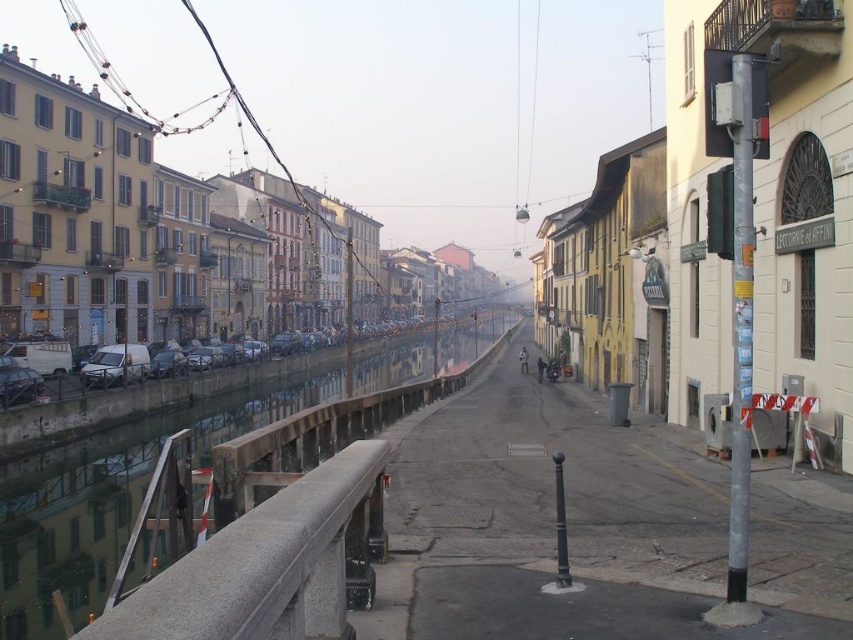
Can you confirm if gray concrete rail at left is bigger than silver metallic van at left?

No.

Does gray concrete rail at left have a greater height compared to silver metallic van at left?

In fact, gray concrete rail at left may be shorter than silver metallic van at left.

Locate an element on the screen. The height and width of the screenshot is (640, 853). gray concrete rail at left is located at coordinates (260, 566).

Image resolution: width=853 pixels, height=640 pixels. Find the location of `gray concrete rail at left`. gray concrete rail at left is located at coordinates (260, 566).

Between concrete water at left and silver metallic van at left, which one has more height?

Standing taller between the two is concrete water at left.

Identify the location of concrete water at left. The width and height of the screenshot is (853, 640). pos(108,500).

Who is more forward, (328, 380) or (138, 358)?

Point (138, 358) is in front.

The height and width of the screenshot is (640, 853). What are the coordinates of `concrete water at left` in the screenshot? It's located at (108, 500).

Does concrete water at left have a lesser width compared to gray concrete rail at left?

No, concrete water at left is not thinner than gray concrete rail at left.

Who is more forward, (15, 552) or (264, 570)?

Point (264, 570) is in front.

Which is behind, point (122, 506) or point (318, 516)?

The point (122, 506) is behind.

Locate an element on the screen. concrete water at left is located at coordinates (108, 500).